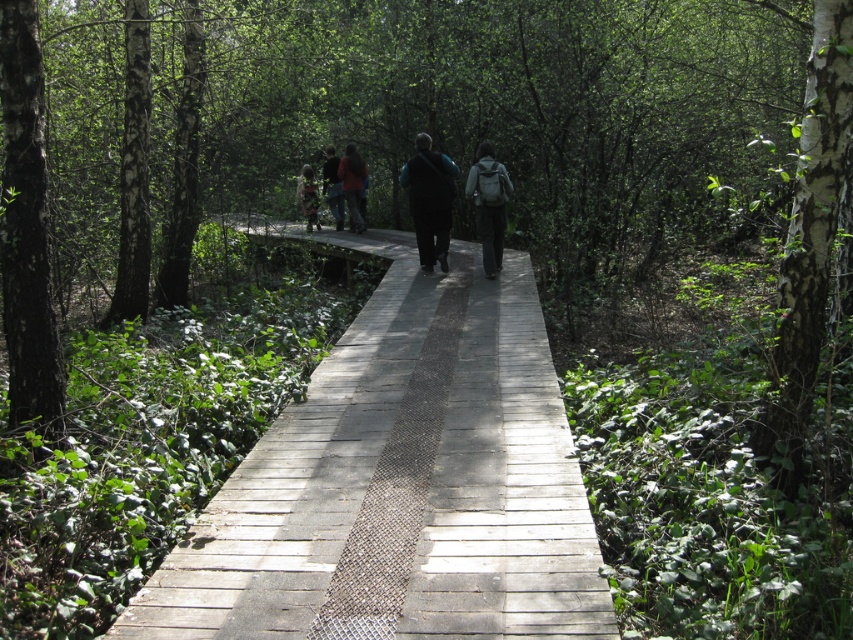
You are standing at the center of the wooden boardwalk and looking towards the direction of the path. Which direction should you turn to face the smooth bark tree at left?

The smooth bark tree at left is located at point (x=26, y=228), which is to the left side of the boardwalk. Therefore, you should turn to your left to face the smooth bark tree at left.

You are standing on the boardwalk and want to take a photo of the smooth bark tree at left. If your camera can focus on objects up to 15 feet away, will you need to move closer or farther away to capture the tree clearly?

The smooth bark tree at left is 17.78 feet away from you. Since your camera can focus up to 15 feet, you need to move closer to the smooth bark tree at left to ensure it is within the camera range.

You are standing on the wooden boardwalk in the forest and want to reach a point marked as point (428, 208). There is another point, point (302, 179), further ahead on the path. Which point is closer to you as you start walking along the boardwalk?

Point (428, 208) is closer to the viewer than point (302, 179), so the first point you should reach is point (428, 208).